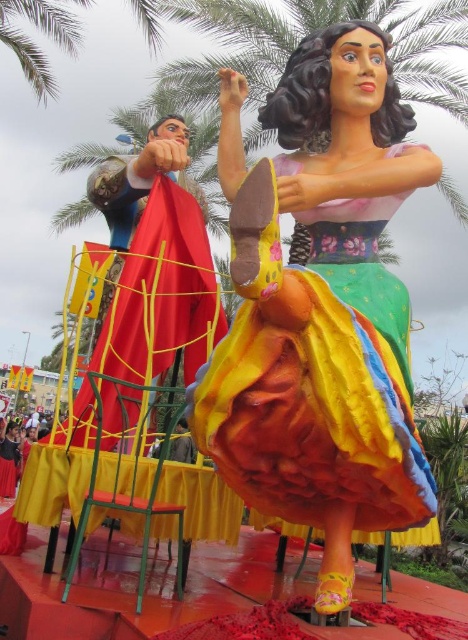
Question: Can you confirm if multicolored tulle skirt at center is smaller than metallic green chair at lower left?

Choices:
 (A) no
 (B) yes

Answer: (B)

Question: Is multicolored tulle skirt at center smaller than metallic green chair at lower left?

Choices:
 (A) yes
 (B) no

Answer: (A)

Question: Is multicolored tulle skirt at center to the left of metallic green chair at lower left from the viewer's perspective?

Choices:
 (A) yes
 (B) no

Answer: (B)